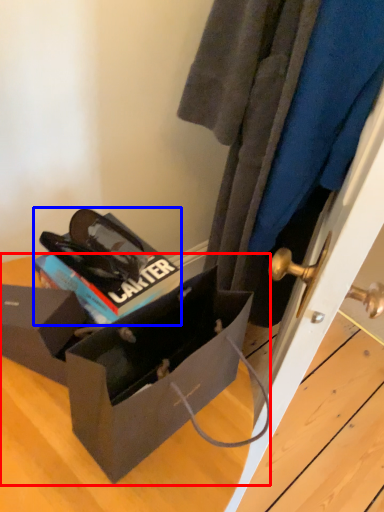
Question: Among these objects, which one is nearest to the camera, box (highlighted by a red box) or kit (highlighted by a blue box)?

Choices:
 (A) box
 (B) kit

Answer: (A)